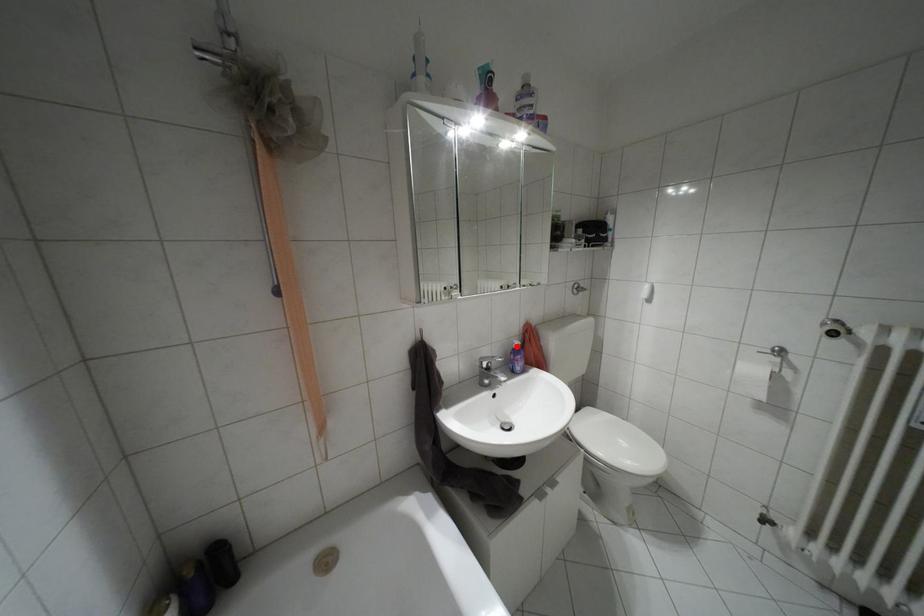
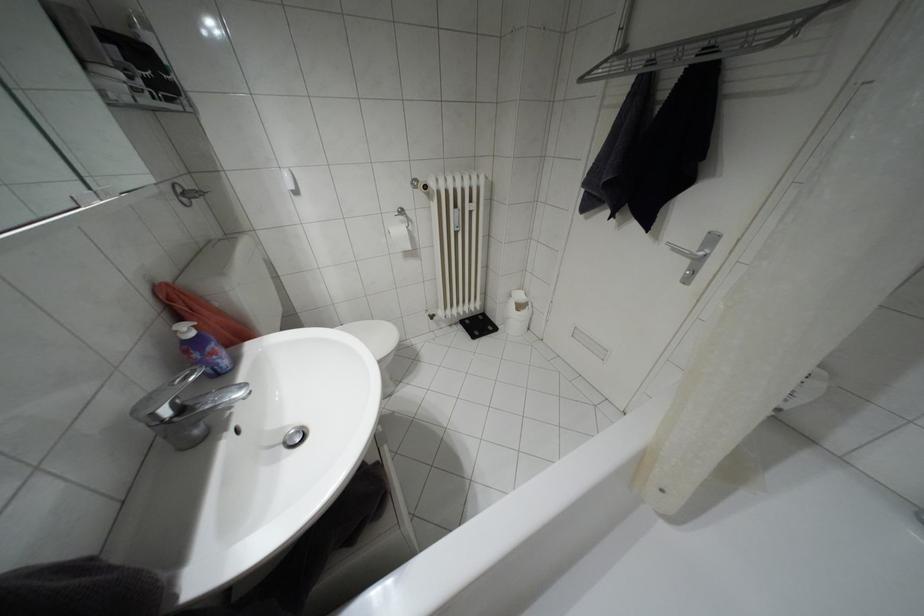
The point at the highlighted location is marked in the first image. Where is the corresponding point in the second image?

(190, 333)